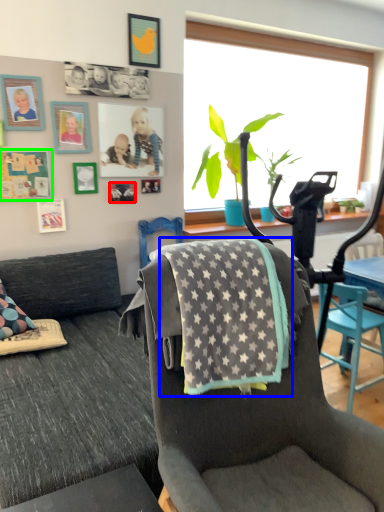
Question: Based on their relative distances, which object is nearer to picture frame (highlighted by a red box)? Choose from blanket (highlighted by a blue box) and picture frame (highlighted by a green box).

Choices:
 (A) blanket
 (B) picture frame

Answer: (B)